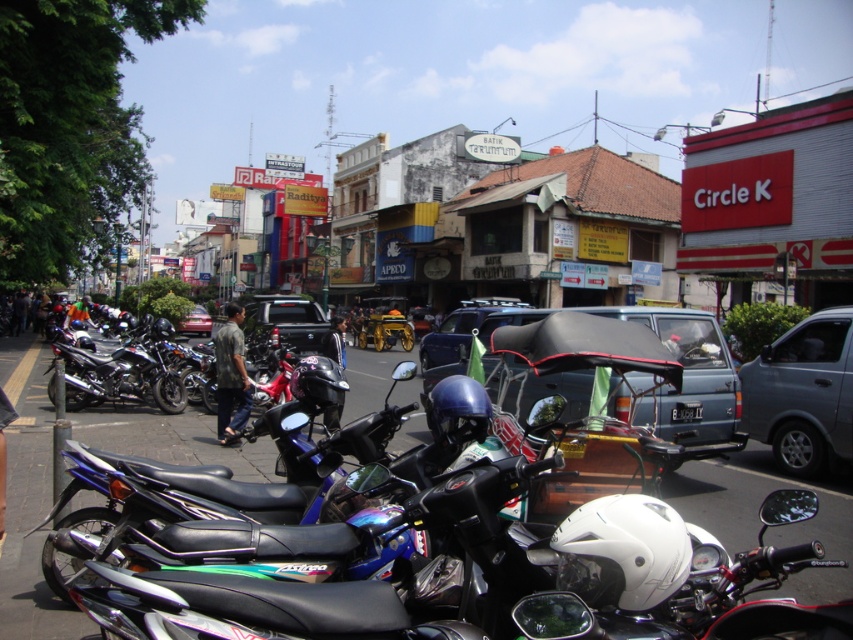
You are a pedestrian standing at the edge of the street. You see a metallic blue pickup truck at center and a light brown shirt at center. Which object is closer to your right side?

The metallic blue pickup truck at center is to the right of the light brown shirt at center, so the metallic blue pickup truck at center is closer to your right side.